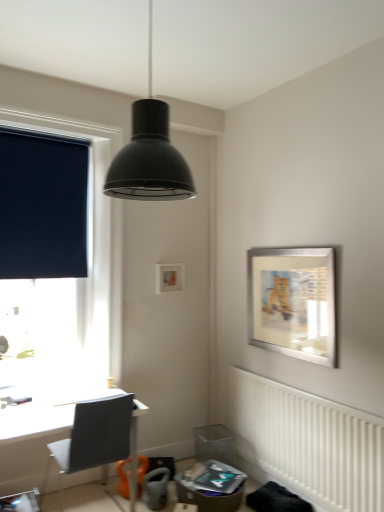
Question: Could you tell me if dark blue roller blind at left is turned towards white textured radiator at lower right?

Choices:
 (A) yes
 (B) no

Answer: (B)

Question: Does dark blue roller blind at left have a greater height compared to white textured radiator at lower right?

Choices:
 (A) yes
 (B) no

Answer: (A)

Question: Is dark blue roller blind at left to the right of white textured radiator at lower right from the viewer's perspective?

Choices:
 (A) yes
 (B) no

Answer: (B)

Question: Is dark blue roller blind at left surrounding white textured radiator at lower right?

Choices:
 (A) yes
 (B) no

Answer: (B)

Question: Is dark blue roller blind at left smaller than white textured radiator at lower right?

Choices:
 (A) no
 (B) yes

Answer: (A)

Question: Would you say gray fabric chair at lower left is to the left or to the right of dark blue fabric at left in the picture?

Choices:
 (A) right
 (B) left

Answer: (A)

Question: From a real-world perspective, is gray fabric chair at lower left positioned above or below dark blue fabric at left?

Choices:
 (A) above
 (B) below

Answer: (B)

Question: In the image, is gray fabric chair at lower left positioned in front of or behind dark blue fabric at left?

Choices:
 (A) front
 (B) behind

Answer: (A)

Question: Which is correct: gray fabric chair at lower left is inside dark blue fabric at left, or outside of it?

Choices:
 (A) outside
 (B) inside

Answer: (A)

Question: Is point (334, 434) positioned closer to the camera than point (82, 173)?

Choices:
 (A) farther
 (B) closer

Answer: (B)

Question: From their relative heights in the image, would you say white textured radiator at lower right is taller or shorter than dark blue fabric at left?

Choices:
 (A) tall
 (B) short

Answer: (B)

Question: Would you say white textured radiator at lower right is to the left or to the right of dark blue fabric at left in the picture?

Choices:
 (A) left
 (B) right

Answer: (B)

Question: From a real-world perspective, is white textured radiator at lower right above or below dark blue fabric at left?

Choices:
 (A) below
 (B) above

Answer: (A)

Question: Is dark blue fabric at left in front of or behind white textured radiator at lower right in the image?

Choices:
 (A) behind
 (B) front

Answer: (A)

Question: From the image's perspective, is dark blue fabric at left above or below white textured radiator at lower right?

Choices:
 (A) above
 (B) below

Answer: (A)